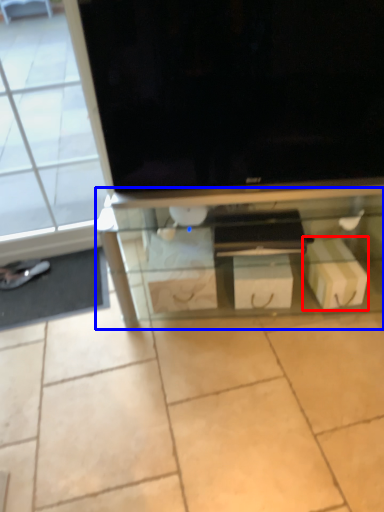
Question: Which object is further to the camera taking this photo, cardboard box (highlighted by a red box) or shelf (highlighted by a blue box)?

Choices:
 (A) cardboard box
 (B) shelf

Answer: (A)